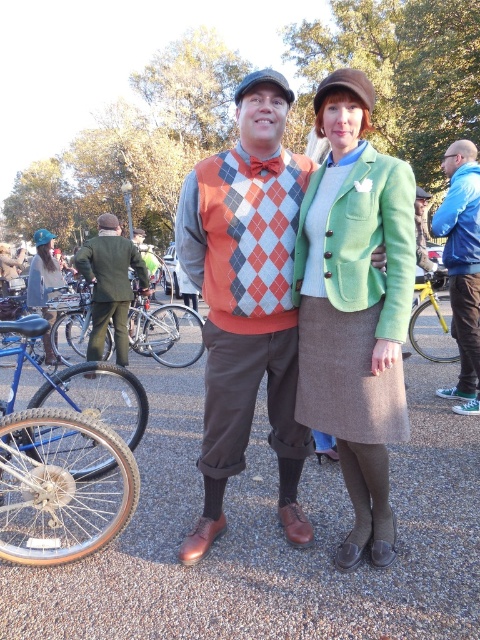
Question: Is green woolen jacket at center to the right of argyle sweater vest at center from the viewer's perspective?

Choices:
 (A) no
 (B) yes

Answer: (B)

Question: Considering the relative positions of yellow metallic bicycle at right and denim jacket at left in the image provided, where is yellow metallic bicycle at right located with respect to denim jacket at left?

Choices:
 (A) left
 (B) right

Answer: (B)

Question: Based on their relative distances, which object is farther from the yellow metallic bicycle at right?

Choices:
 (A) green woolen jacket at center
 (B) blue metallic bicycle at lower left
 (C) green wool coat at left
 (D) blue fabric jacket at upper right

Answer: (A)

Question: Based on their relative distances, which object is farther from the argyle sweater vest at center?

Choices:
 (A) green woolen jacket at center
 (B) blue metallic bicycle at lower left
 (C) green wool coat at left
 (D) denim jacket at left

Answer: (D)

Question: Can you confirm if argyle sweater vest at center is smaller than blue fabric jacket at upper right?

Choices:
 (A) yes
 (B) no

Answer: (B)

Question: Which of the following is the farthest from the observer?

Choices:
 (A) (49, 276)
 (B) (105, 417)
 (C) (456, 257)
 (D) (372, 179)

Answer: (A)